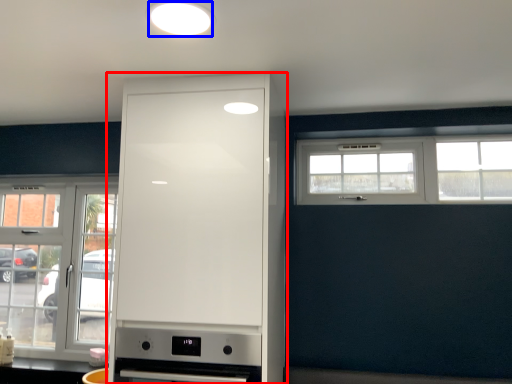
Question: Which object is closer to the camera taking this photo, cabinetry (highlighted by a red box) or lighting (highlighted by a blue box)?

Choices:
 (A) cabinetry
 (B) lighting

Answer: (B)